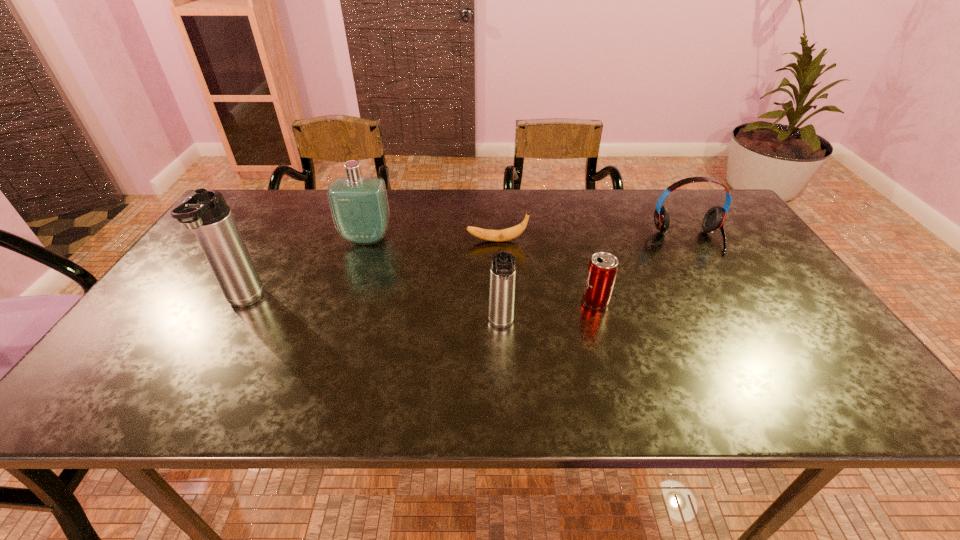
Please point a vacant point for placing a thermos bottle on the right. Please provide its 2D coordinates. Your answer should be formatted as a tuple, i.e. [(x, y)], where the tuple contains the x and y coordinates of a point satisfying the conditions above.

[(789, 350)]